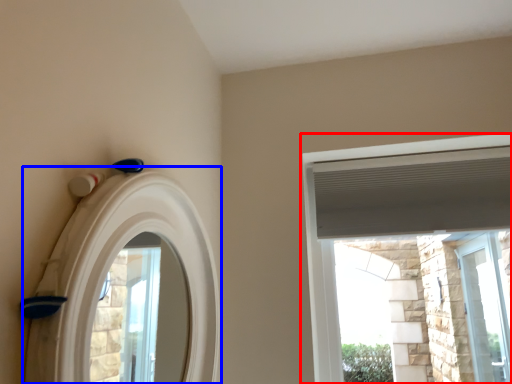
Question: Which of the following is the closest to the observer, window (highlighted by a red box) or archway (highlighted by a blue box)?

Choices:
 (A) window
 (B) archway

Answer: (B)